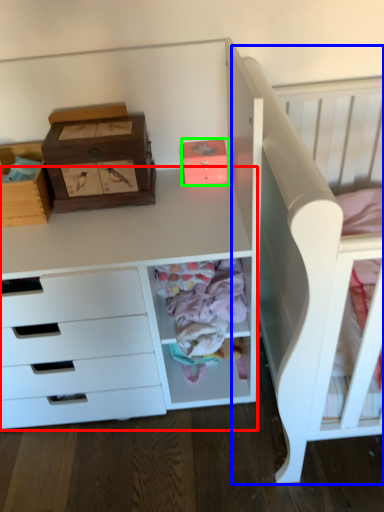
Question: Based on their relative distances, which object is nearer to computer desk (highlighted by a red box)? Choose from bed (highlighted by a blue box) and shoe box (highlighted by a green box).

Choices:
 (A) bed
 (B) shoe box

Answer: (A)